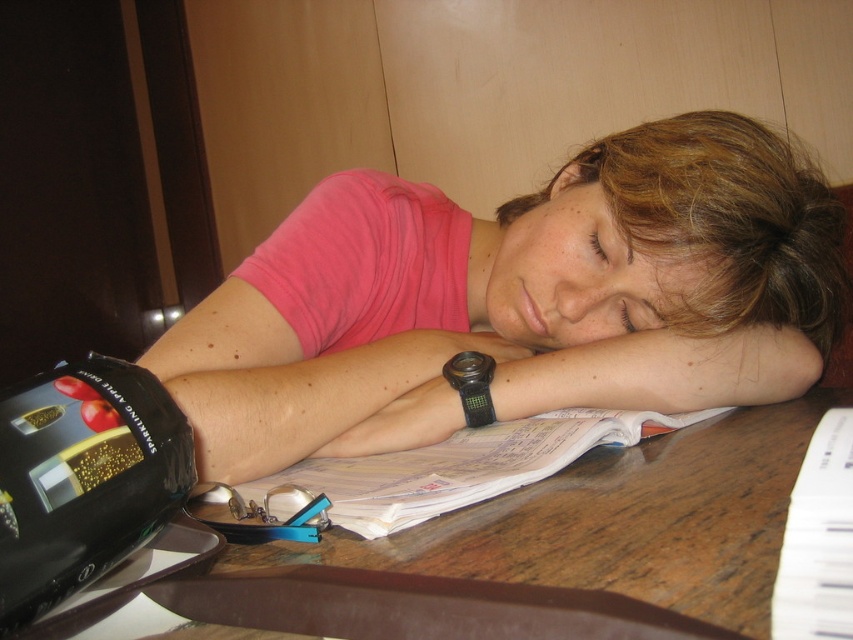
Does point (782, 324) lie in front of point (665, 285)?

No, (782, 324) is behind (665, 285).

Between point (656, 147) and point (643, 218), which one is positioned in front?

Positioned in front is point (643, 218).

Is point (543, 397) closer to camera compared to point (752, 224)?

That is True.

This screenshot has height=640, width=853. Identify the location of pink fabric shirt at center. [517, 298].